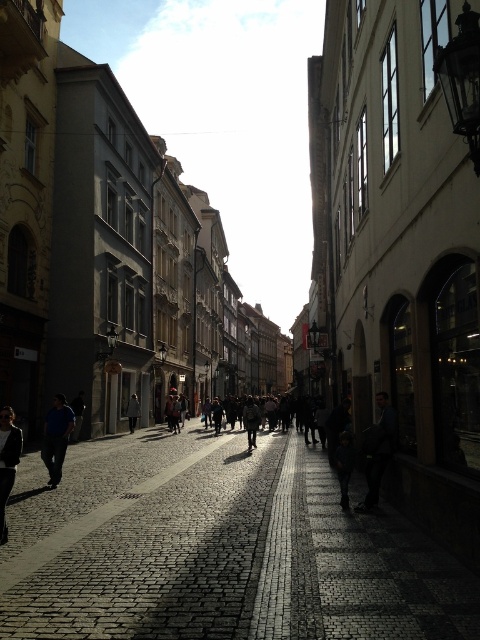
Can you confirm if blue denim jeans at lower left is positioned to the left of dark gray sweater at lower left?

Correct, you'll find blue denim jeans at lower left to the left of dark gray sweater at lower left.

Does blue denim jeans at lower left appear over dark gray sweater at lower left?

No.

Between point (59, 422) and point (16, 432), which one is positioned behind?

Point (59, 422)

Image resolution: width=480 pixels, height=640 pixels. In order to click on blue denim jeans at lower left in this screenshot , I will do `click(57, 436)`.

Does dark gray sweater at lower left have a smaller size compared to dark gray coat at center?

Correct, dark gray sweater at lower left occupies less space than dark gray coat at center.

Which is more to the right, dark gray sweater at lower left or dark gray coat at center?

dark gray sweater at lower left

What do you see at coordinates (8, 461) in the screenshot? I see `dark gray sweater at lower left` at bounding box center [8, 461].

Where is `dark gray sweater at lower left`? The image size is (480, 640). dark gray sweater at lower left is located at coordinates click(8, 461).

Does blue denim jeans at lower left have a lesser height compared to dark gray fabric jacket at center?

Incorrect, blue denim jeans at lower left's height does not fall short of dark gray fabric jacket at center's.

Does blue denim jeans at lower left have a smaller size compared to dark gray fabric jacket at center?

No.

Is point (50, 486) positioned behind point (340, 452)?

Yes.

Where is `blue denim jeans at lower left`? The image size is (480, 640). blue denim jeans at lower left is located at coordinates (57, 436).